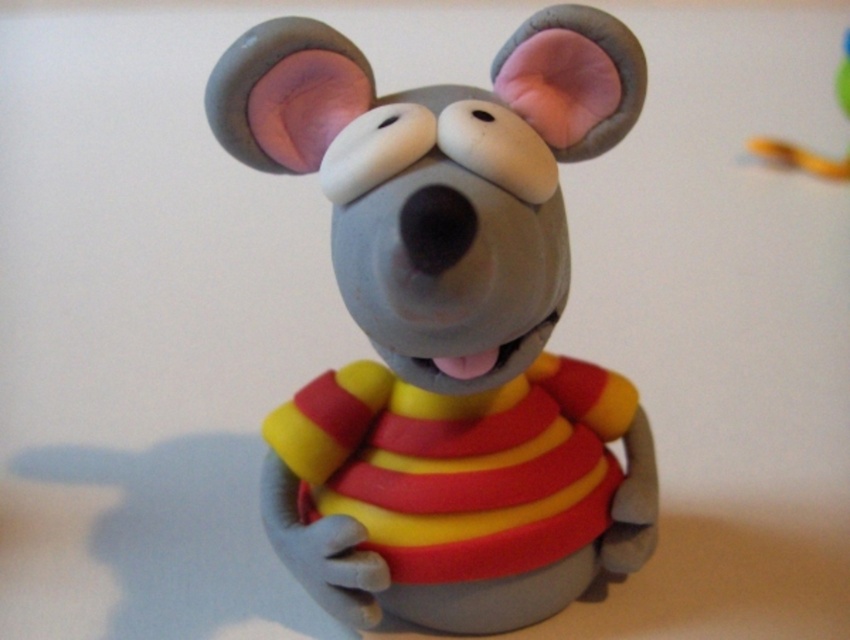
Question: Observing the image, what is the correct spatial positioning of matte clay mouse at center in reference to rubber yellow snake at upper right?

Choices:
 (A) right
 (B) left

Answer: (B)

Question: Which of the following is the closest to the observer?

Choices:
 (A) rubber yellow snake at upper right
 (B) matte clay mouse at center

Answer: (B)

Question: From the image, what is the correct spatial relationship of matte clay mouse at center in relation to rubber yellow snake at upper right?

Choices:
 (A) right
 (B) left

Answer: (B)

Question: Where is matte clay mouse at center located in relation to rubber yellow snake at upper right in the image?

Choices:
 (A) above
 (B) below

Answer: (B)

Question: Among these objects, which one is farthest from the camera?

Choices:
 (A) rubber yellow snake at upper right
 (B) matte clay mouse at center

Answer: (A)